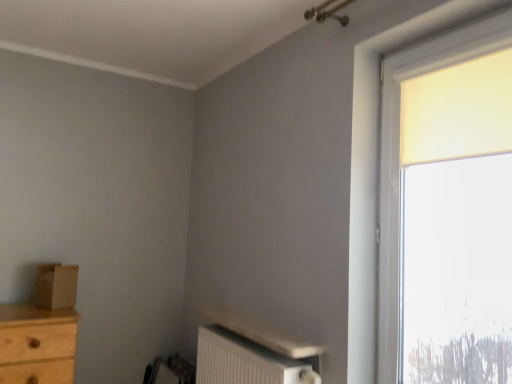
Question: Considering their positions, is matte yellow curtain at upper right located in front of or behind matte yellow curtain at right?

Choices:
 (A) front
 (B) behind

Answer: (B)

Question: Choose the correct answer: Is matte yellow curtain at upper right inside matte yellow curtain at right or outside it?

Choices:
 (A) inside
 (B) outside

Answer: (A)

Question: Estimate the real-world distances between objects in this image. Which object is farther from the matte yellow curtain at upper right?

Choices:
 (A) brown cardboard box at left
 (B) matte yellow curtain at right
 (C) white textured radiator at lower center

Answer: (A)

Question: Which of these objects is positioned farthest from the brown cardboard box at left?

Choices:
 (A) white textured radiator at lower center
 (B) matte yellow curtain at upper right
 (C) matte yellow curtain at right

Answer: (B)